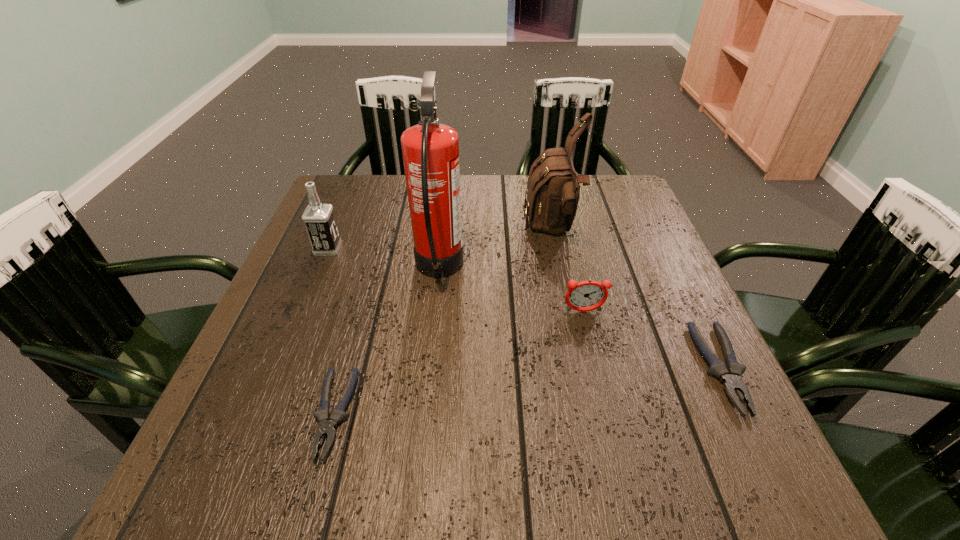
I want to click on the left pliers, so click(327, 427).

Locate an element on the screen. the second object from left to right is located at coordinates (327, 427).

Find the location of a particular element. The height and width of the screenshot is (540, 960). the taller pliers is located at coordinates (730, 375).

In order to click on the fifth tallest object in this screenshot , I will do tap(730, 375).

What are the coordinates of `the third object from left to right` in the screenshot? It's located at (430, 150).

Find the location of `the tallest object`. the tallest object is located at coordinates (430, 150).

Where is `vodka`? vodka is located at coordinates (319, 219).

Identify the location of the third tallest object. The width and height of the screenshot is (960, 540). (319, 219).

Locate an element on the screen. Image resolution: width=960 pixels, height=540 pixels. the second tallest object is located at coordinates (553, 188).

The height and width of the screenshot is (540, 960). Find the location of `the third shortest object`. the third shortest object is located at coordinates (585, 296).